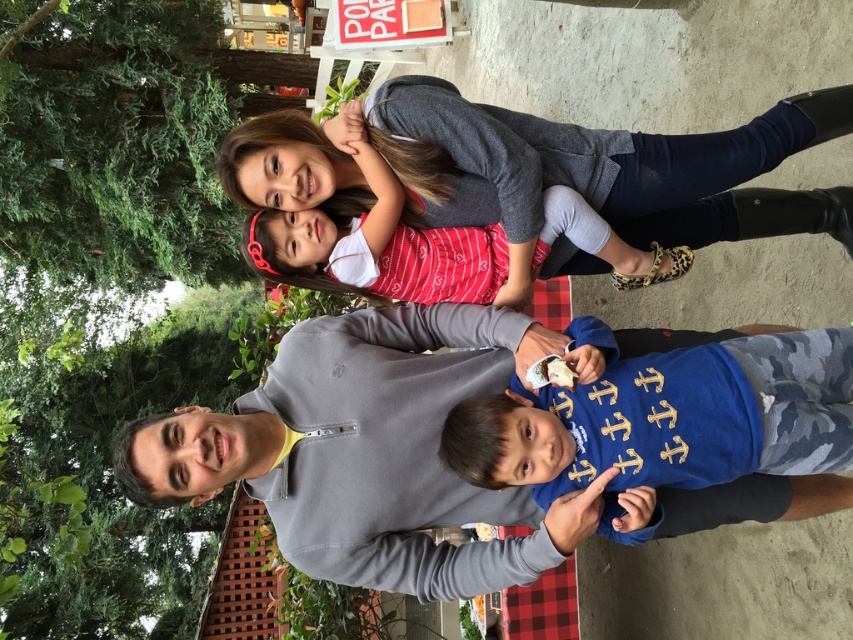
Does point (157, 452) come closer to viewer compared to point (474, 170)?

Yes, it is in front of point (474, 170).

Who is shorter, gray fleece at center or red striped shirt at upper center?

red striped shirt at upper center

The height and width of the screenshot is (640, 853). Describe the element at coordinates (368, 451) in the screenshot. I see `gray fleece at center` at that location.

Locate an element on the screen. The height and width of the screenshot is (640, 853). gray fleece at center is located at coordinates (368, 451).

Is red striped shirt at upper center behind blue camouflage shirt at center?

Yes.

Can you confirm if red striped shirt at upper center is positioned above blue camouflage shirt at center?

Indeed, red striped shirt at upper center is positioned over blue camouflage shirt at center.

In the scene shown: Who is more forward, (x=422, y=150) or (x=683, y=477)?

Positioned in front is point (x=683, y=477).

You are a GUI agent. You are given a task and a screenshot of the screen. Output one action in this format:
    pyautogui.click(x=<x>, y=<y>)
    Task: Click on the red striped shirt at upper center
    
    Given the screenshot: What is the action you would take?
    pyautogui.click(x=601, y=170)

Can you confirm if gray fleece at center is thinner than blue camouflage shirt at center?

No.

Does gray fleece at center have a greater height compared to blue camouflage shirt at center?

Yes, gray fleece at center is taller than blue camouflage shirt at center.

The image size is (853, 640). Describe the element at coordinates (368, 451) in the screenshot. I see `gray fleece at center` at that location.

You are a GUI agent. You are given a task and a screenshot of the screen. Output one action in this format:
    pyautogui.click(x=<x>, y=<y>)
    Task: Click on the gray fleece at center
    Image resolution: width=853 pixels, height=640 pixels.
    Given the screenshot: What is the action you would take?
    pyautogui.click(x=368, y=451)